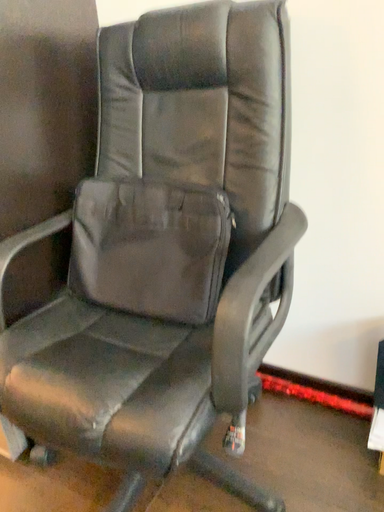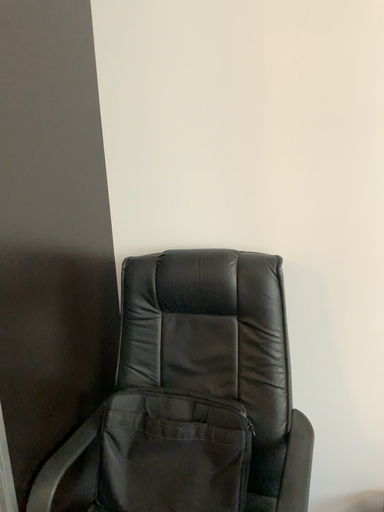
Question: Which way did the camera rotate in the video?

Choices:
 (A) rotated right
 (B) rotated left

Answer: (A)